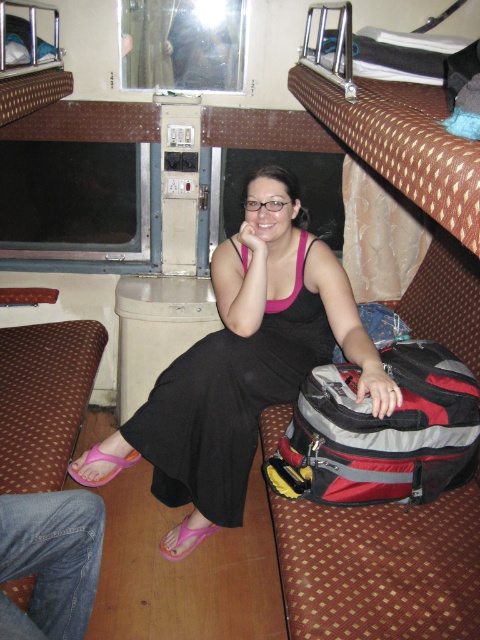
Question: Does black satin dress at center lie in front of red and gray fabric backpack at lower right?

Choices:
 (A) no
 (B) yes

Answer: (A)

Question: Based on their relative distances, which object is farther from the pink rubber sandal at lower left?

Choices:
 (A) black satin dress at center
 (B) pink fabric sandal at lower center

Answer: (A)

Question: Does black satin dress at center have a smaller size compared to red and gray fabric backpack at lower right?

Choices:
 (A) no
 (B) yes

Answer: (A)

Question: Which of the following is the farthest from the observer?

Choices:
 (A) black satin dress at center
 (B) red and gray fabric backpack at lower right
 (C) pink fabric sandal at lower center

Answer: (C)

Question: Does red and gray fabric backpack at lower right have a larger size compared to pink rubber sandal at lower left?

Choices:
 (A) no
 (B) yes

Answer: (B)

Question: Which point is farther from the camera taking this photo?

Choices:
 (A) (236, 518)
 (B) (301, 406)
 (C) (87, 456)
 (D) (196, 529)

Answer: (D)